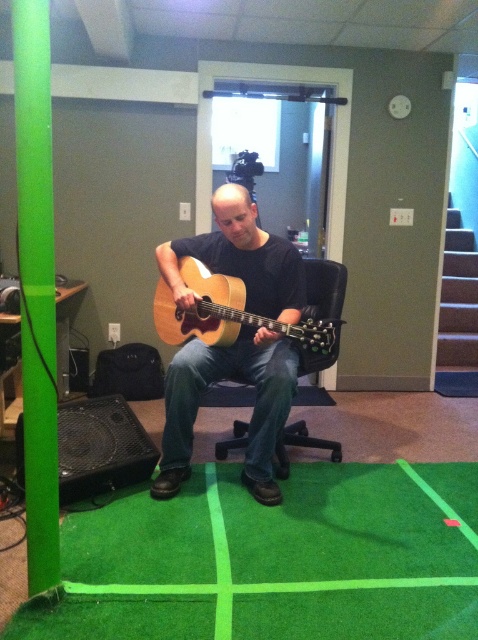
Question: Is wooden acoustic guitar at center smaller than light brown acoustic guitar at center?

Choices:
 (A) no
 (B) yes

Answer: (A)

Question: Which object is the closest to the wooden acoustic guitar at center?

Choices:
 (A) light brown acoustic guitar at center
 (B) black plastic swivel chair at center

Answer: (A)

Question: Among these points, which one is farthest from the camera?

Choices:
 (A) (176, 273)
 (B) (240, 300)
 (C) (334, 292)

Answer: (C)

Question: In this image, where is light brown acoustic guitar at center located relative to black plastic swivel chair at center?

Choices:
 (A) right
 (B) left

Answer: (B)

Question: Which object is farther from the camera taking this photo?

Choices:
 (A) black plastic swivel chair at center
 (B) wooden acoustic guitar at center
 (C) light brown acoustic guitar at center

Answer: (A)

Question: Does wooden acoustic guitar at center come in front of black plastic swivel chair at center?

Choices:
 (A) no
 (B) yes

Answer: (B)